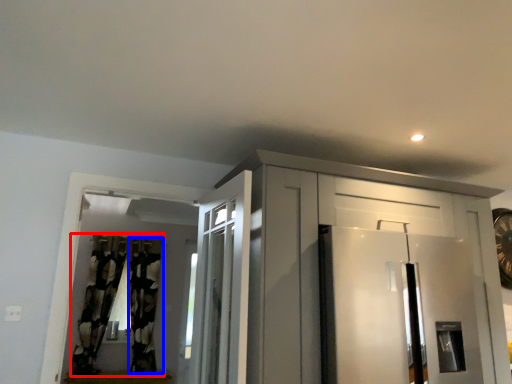
Question: Which object appears closest to the camera in this image, curtain (highlighted by a red box) or curtain (highlighted by a blue box)?

Choices:
 (A) curtain
 (B) curtain

Answer: (A)